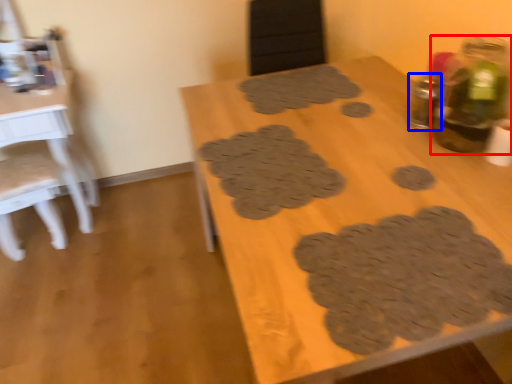
Question: Among these objects, which one is farthest to the camera, bottle (highlighted by a red box) or bottle (highlighted by a blue box)?

Choices:
 (A) bottle
 (B) bottle

Answer: (B)